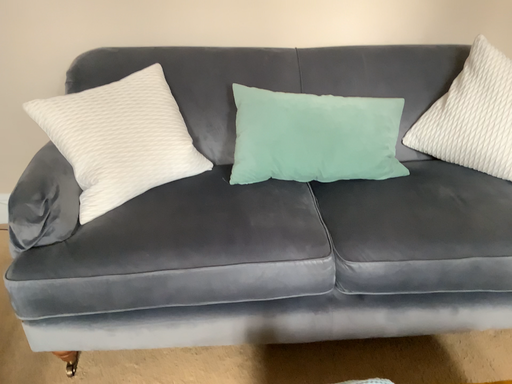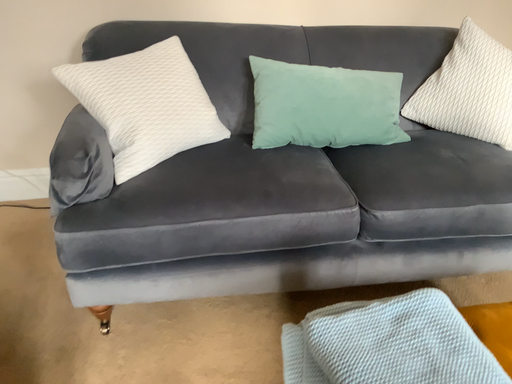
Question: How did the camera likely rotate when shooting the video?

Choices:
 (A) rotated left
 (B) rotated right

Answer: (B)